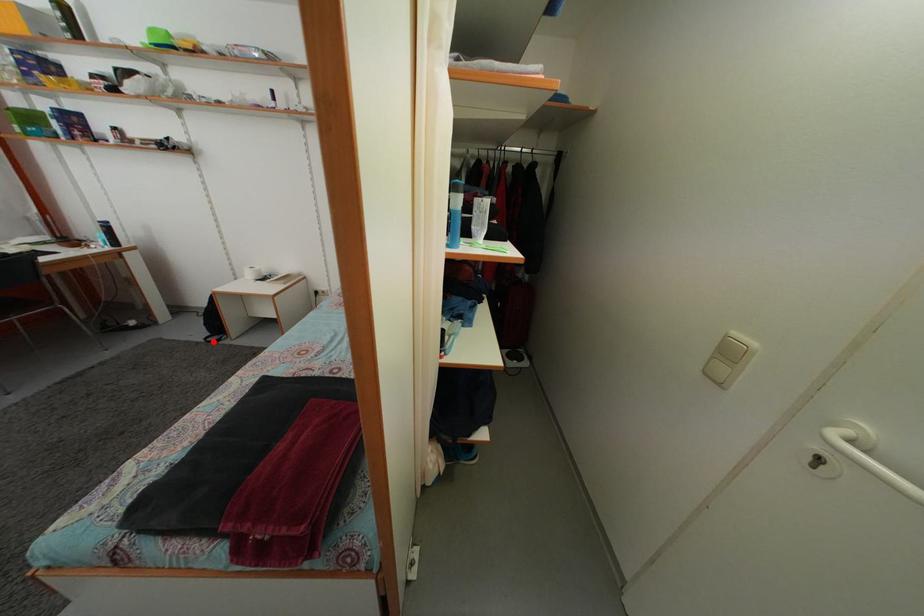
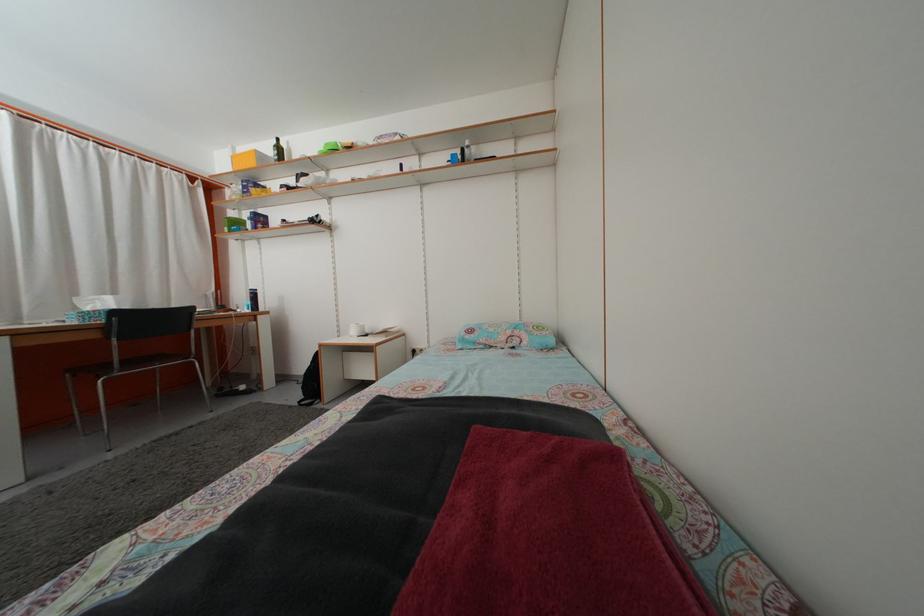
The point at the highlighted location is marked in the first image. Where is the corresponding point in the second image?

(309, 405)